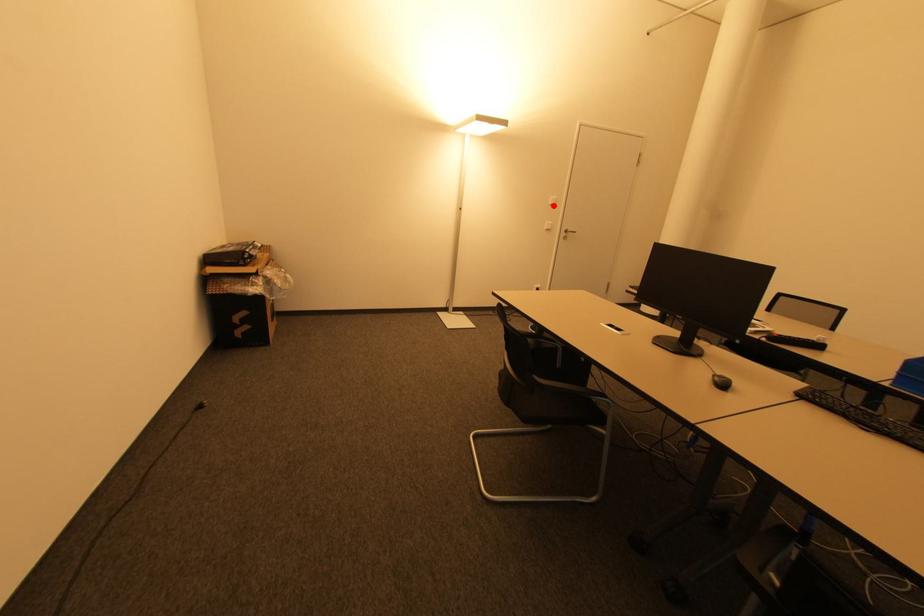
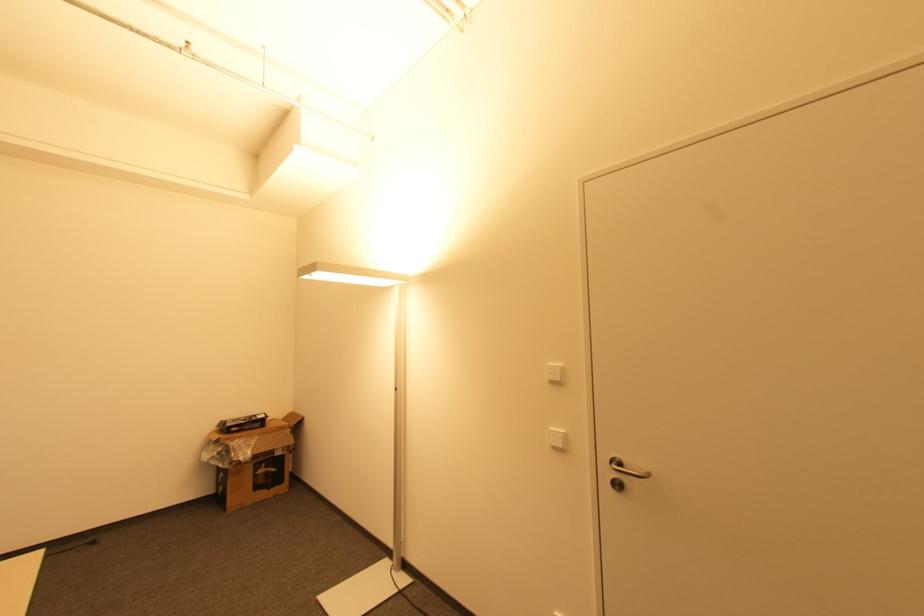
The point at the highlighted location is marked in the first image. Where is the corresponding point in the second image?

(554, 383)